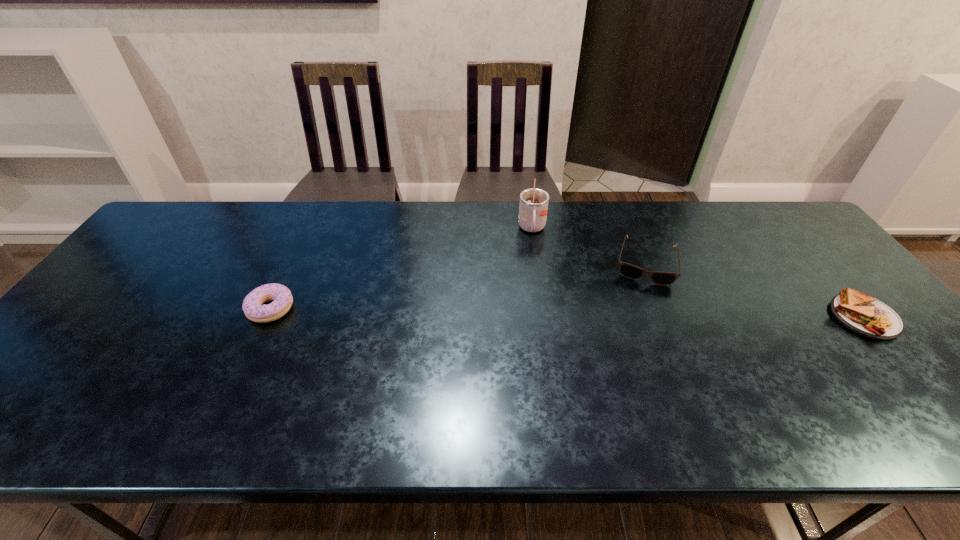
The image size is (960, 540). I want to click on object that is the second closest to the second object from right to left, so click(x=861, y=313).

Locate which object ranks third in proximity to the third object from left to right. Please provide its 2D coordinates. Your answer should be formatted as a tuple, i.e. [(x, y)], where the tuple contains the x and y coordinates of a point satisfying the conditions above.

[(253, 307)]

I want to click on vacant space that satisfies the following two spatial constraints: 1. on the back side of the leftmost object; 2. on the left side of the sunglasses, so click(293, 263).